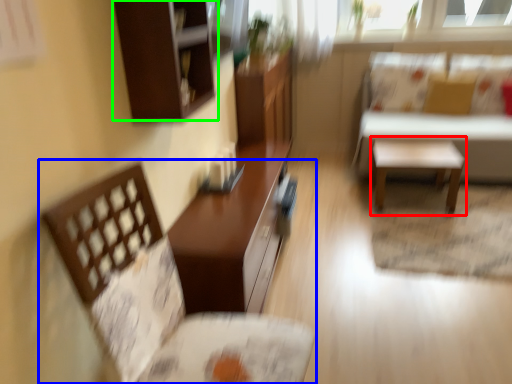
Question: Considering the real-world distances, which object is closest to side table (highlighted by a red box)? chair (highlighted by a blue box) or cabinetry (highlighted by a green box).

Choices:
 (A) chair
 (B) cabinetry

Answer: (B)